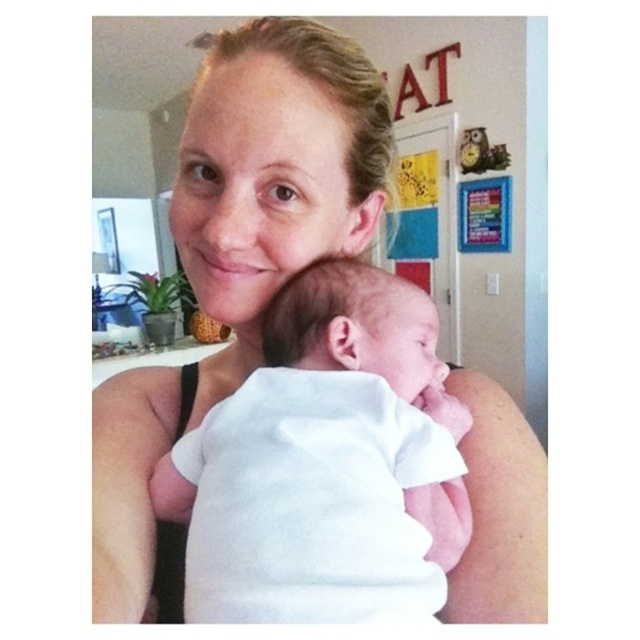
Question: Which of the following is the farthest from the observer?

Choices:
 (A) (317, 310)
 (B) (372, 138)

Answer: (B)

Question: Does matte white tank top at center appear on the right side of white soft baby at center?

Choices:
 (A) yes
 (B) no

Answer: (B)

Question: Is matte white tank top at center to the left of white soft baby at center from the viewer's perspective?

Choices:
 (A) no
 (B) yes

Answer: (B)

Question: Does matte white tank top at center appear on the right side of white soft baby at center?

Choices:
 (A) no
 (B) yes

Answer: (A)

Question: Which point is farther to the camera?

Choices:
 (A) (476, 552)
 (B) (394, 563)

Answer: (A)